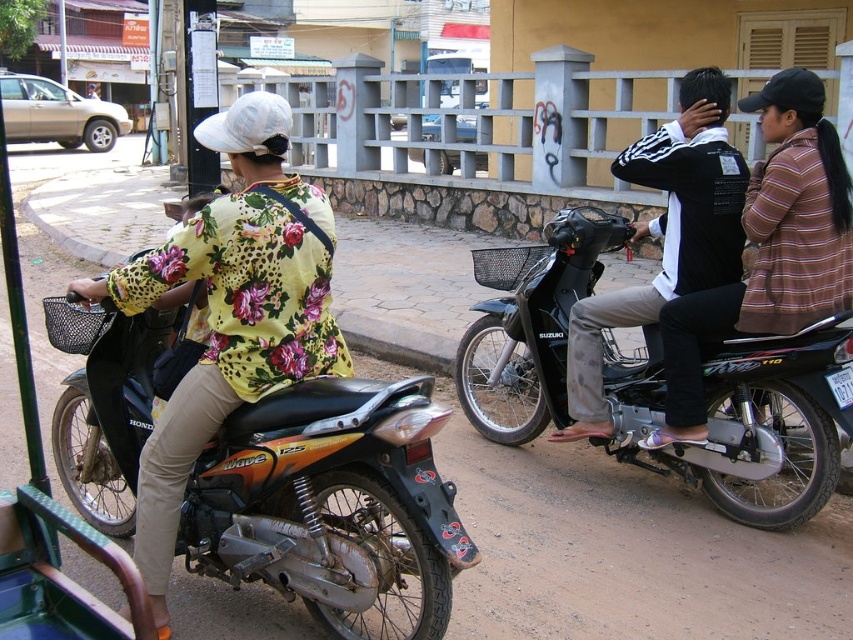
Question: Can you confirm if orange matte motorcycle at center is smaller than black matte jacket at center?

Choices:
 (A) no
 (B) yes

Answer: (B)

Question: Which point is farther from the camera taking this photo?

Choices:
 (A) (711, 269)
 (B) (763, 340)
 (C) (140, 369)

Answer: (A)

Question: Estimate the real-world distances between objects in this image. Which object is closer to the black matte jacket at center?

Choices:
 (A) black matte motorcycle at center
 (B) orange matte motorcycle at center

Answer: (A)

Question: Does orange matte motorcycle at center appear over black matte motorcycle at center?

Choices:
 (A) no
 (B) yes

Answer: (A)

Question: Among these objects, which one is nearest to the camera?

Choices:
 (A) orange matte motorcycle at center
 (B) black matte jacket at center

Answer: (A)

Question: Does orange matte motorcycle at center have a lesser width compared to black matte motorcycle at center?

Choices:
 (A) yes
 (B) no

Answer: (B)